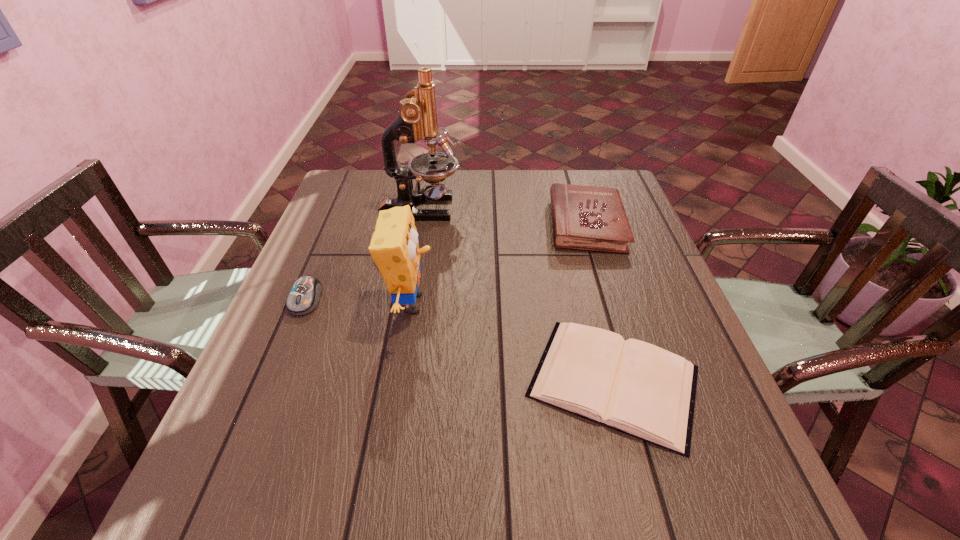
In order to click on vacant space situated 0.140m on the left of the farther hardback book in this screenshot , I will do `click(498, 225)`.

You are a GUI agent. You are given a task and a screenshot of the screen. Output one action in this format:
    pyautogui.click(x=<x>, y=<y>)
    Task: Click on the free spot located on the wheel side of the fourth tallest object
    The width and height of the screenshot is (960, 540).
    Given the screenshot: What is the action you would take?
    pyautogui.click(x=230, y=483)

Image resolution: width=960 pixels, height=540 pixels. In order to click on free region located on the back of the shortest object in this screenshot , I will do `click(594, 307)`.

The image size is (960, 540). I want to click on microscope located in the far edge section of the desktop, so pos(417,118).

Locate an element on the screen. This screenshot has width=960, height=540. hardback book present at the far edge is located at coordinates (592, 218).

You are a GUI agent. You are given a task and a screenshot of the screen. Output one action in this format:
    pyautogui.click(x=<x>, y=<y>)
    Task: Click on the microscope situated at the left edge
    This screenshot has height=540, width=960.
    Given the screenshot: What is the action you would take?
    pyautogui.click(x=417, y=118)

Locate an element on the screen. computer mouse that is at the left edge is located at coordinates (303, 298).

This screenshot has height=540, width=960. I want to click on object situated at the far left corner, so click(417, 118).

In order to click on object located at the far right corner in this screenshot , I will do `click(592, 218)`.

The image size is (960, 540). I want to click on vacant space at the far edge of the desktop, so click(546, 204).